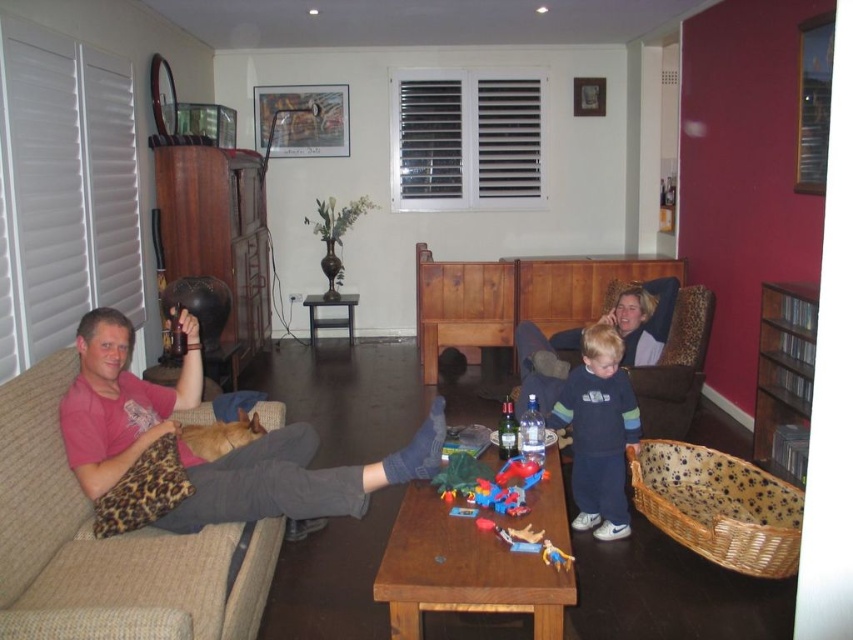
Question: Which object appears farthest from the camera in this image?

Choices:
 (A) beige fabric couch at left
 (B) plastic red car at center

Answer: (B)

Question: Can you confirm if beige fabric couch at left is positioned to the left of dark blue fleece at center?

Choices:
 (A) no
 (B) yes

Answer: (B)

Question: Which of the following is the closest to the observer?

Choices:
 (A) rubber yellow toy at lower center
 (B) beige fabric couch at left

Answer: (B)

Question: Can you confirm if dark blue fleece at center is positioned to the right of plastic red car at center?

Choices:
 (A) yes
 (B) no

Answer: (A)

Question: Is dark blue fleece at center thinner than plastic red car at center?

Choices:
 (A) no
 (B) yes

Answer: (B)

Question: Among these points, which one is farthest from the camera?

Choices:
 (A) (219, 520)
 (B) (637, 419)
 (C) (462, 467)

Answer: (B)